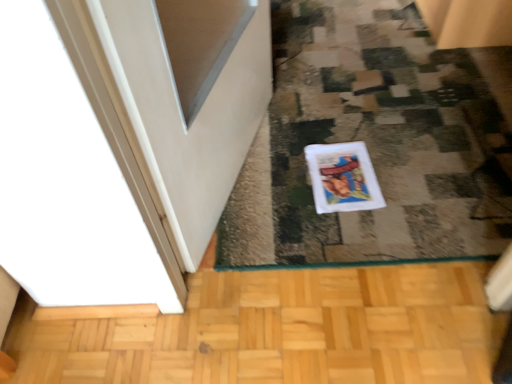
Question: Are white fabric doormat at center and white matte comic book at center beside each other?

Choices:
 (A) yes
 (B) no

Answer: (B)

Question: Would you say white fabric doormat at center contains white matte comic book at center?

Choices:
 (A) no
 (B) yes

Answer: (B)

Question: From a real-world perspective, does white fabric doormat at center stand above white matte comic book at center?

Choices:
 (A) no
 (B) yes

Answer: (B)

Question: Does white fabric doormat at center have a lesser height compared to white matte comic book at center?

Choices:
 (A) no
 (B) yes

Answer: (A)

Question: From a real-world perspective, is white fabric doormat at center beneath white matte comic book at center?

Choices:
 (A) no
 (B) yes

Answer: (A)

Question: Considering the relative sizes of white fabric doormat at center and white matte comic book at center in the image provided, is white fabric doormat at center thinner than white matte comic book at center?

Choices:
 (A) no
 (B) yes

Answer: (A)

Question: Would you say white matte comic book at center contains white fabric doormat at center?

Choices:
 (A) yes
 (B) no

Answer: (B)

Question: From a real-world perspective, is white matte comic book at center positioned under white fabric doormat at center based on gravity?

Choices:
 (A) no
 (B) yes

Answer: (B)

Question: Is white matte comic book at center facing towards white fabric doormat at center?

Choices:
 (A) no
 (B) yes

Answer: (B)

Question: From the image's perspective, is white matte comic book at center under white fabric doormat at center?

Choices:
 (A) no
 (B) yes

Answer: (B)

Question: From the image's perspective, does white matte comic book at center appear higher than white fabric doormat at center?

Choices:
 (A) yes
 (B) no

Answer: (B)

Question: Is white matte comic book at center beside white fabric doormat at center?

Choices:
 (A) no
 (B) yes

Answer: (A)

Question: Would you say white fabric doormat at center is inside or outside white matte comic book at center?

Choices:
 (A) inside
 (B) outside

Answer: (B)